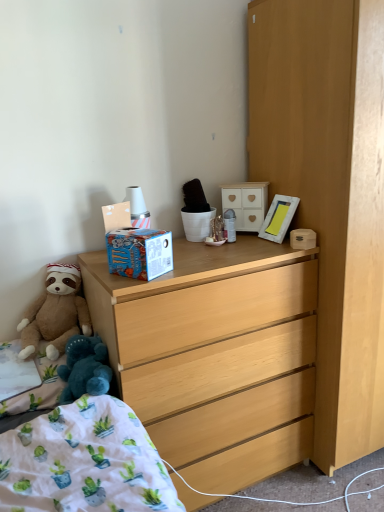
This screenshot has height=512, width=384. Describe the element at coordinates (55, 313) in the screenshot. I see `brown plush teddy bear at lower left` at that location.

What do you see at coordinates (216, 355) in the screenshot? Image resolution: width=384 pixels, height=512 pixels. I see `light wood dresser at center` at bounding box center [216, 355].

This screenshot has width=384, height=512. Describe the element at coordinates (246, 203) in the screenshot. I see `white painted wood cabinet at upper center, which is the 2th cabinetry from bottom to top` at that location.

Locate an element on the screen. The image size is (384, 512). light wood dresser at right, which ranks as the first cabinetry in right-to-left order is located at coordinates (330, 191).

Which is behind, point (55, 310) or point (295, 223)?

The point (295, 223) is farther from the camera.

Is brown plush teddy bear at lower left thinner than light wood dresser at right, which ranks as the 2th cabinetry in left-to-right order?

Yes.

Does brown plush teddy bear at lower left have a larger size compared to light wood dresser at right, the second cabinetry in the back-to-front sequence?

No.

Consider the image. From the image's perspective, is brown plush teddy bear at lower left on light wood dresser at right, which ranks as the first cabinetry in right-to-left order?

Actually, brown plush teddy bear at lower left appears below light wood dresser at right, which ranks as the first cabinetry in right-to-left order, in the image.

Which of these two, white wooden picture frame at upper right or light wood dresser at right, marked as the second cabinetry in a top-to-bottom arrangement, stands shorter?

white wooden picture frame at upper right.

Which is less distant, (x=267, y=229) or (x=344, y=388)?

The point (x=344, y=388) is more forward.

Identify the location of picture frame on the left of light wood dresser at right, which ranks as the 2th cabinetry in left-to-right order. 279,218.

From a real-world perspective, is white wooden picture frame at upper right located higher than light wood dresser at right, positioned as the first cabinetry in front-to-back order?

Correct, in the physical world, white wooden picture frame at upper right is higher than light wood dresser at right, positioned as the first cabinetry in front-to-back order.

Which object is positioned more to the right, light wood dresser at right, marked as the second cabinetry in a top-to-bottom arrangement, or white painted wood cabinet at upper center, which is counted as the 2th cabinetry, starting from the right?

light wood dresser at right, marked as the second cabinetry in a top-to-bottom arrangement, is more to the right.

Which is farther, (324,239) or (259,182)?

The point (259,182) is behind.

Looking at this image, could you tell me if light wood dresser at right, marked as the second cabinetry in a top-to-bottom arrangement, is facing white painted wood cabinet at upper center, which is counted as the 2th cabinetry, starting from the right?

No, light wood dresser at right, marked as the second cabinetry in a top-to-bottom arrangement, is not turned towards white painted wood cabinet at upper center, which is counted as the 2th cabinetry, starting from the right.

Looking at this image, is the surface of light wood dresser at right, positioned as the first cabinetry in front-to-back order, in direct contact with white painted wood cabinet at upper center, which is the 2th cabinetry from bottom to top?

light wood dresser at right, positioned as the first cabinetry in front-to-back order, and white painted wood cabinet at upper center, which is the 2th cabinetry from bottom to top, are not in contact.

Is white wooden picture frame at upper right to the right of light wood dresser at center from the viewer's perspective?

Yes.

In the image, there is a white wooden picture frame at upper right. Where is `desk below it (from the image's perspective)`? The image size is (384, 512). desk below it (from the image's perspective) is located at coordinates (216, 355).

Is point (281, 199) behind point (213, 405)?

Yes, point (281, 199) is farther from viewer.

Is white wooden picture frame at upper right inside the boundaries of light wood dresser at center, or outside?

white wooden picture frame at upper right is not inside light wood dresser at center, it's outside.

Is light wood dresser at right, which ranks as the first cabinetry in right-to-left order, oriented away from brown plush teddy bear at lower left?

light wood dresser at right, which ranks as the first cabinetry in right-to-left order, does not have its back to brown plush teddy bear at lower left.

Looking at this image, from the image's perspective, is light wood dresser at right, which ranks as the 2th cabinetry in left-to-right order, above or below brown plush teddy bear at lower left?

From the image's perspective, light wood dresser at right, which ranks as the 2th cabinetry in left-to-right order, appears above brown plush teddy bear at lower left.

From a real-world perspective, is light wood dresser at right, which is the first cabinetry in bottom-to-top order, physically below brown plush teddy bear at lower left?

No, from a real-world perspective, light wood dresser at right, which is the first cabinetry in bottom-to-top order, is not under brown plush teddy bear at lower left.

Could you measure the distance between light wood dresser at right, positioned as the first cabinetry in front-to-back order, and brown plush teddy bear at lower left?

They are 3.40 feet apart.

Is light wood dresser at center positioned with its back to light wood dresser at right, which is the first cabinetry in bottom-to-top order?

light wood dresser at center is not turned away from light wood dresser at right, which is the first cabinetry in bottom-to-top order.

Do you think light wood dresser at center is within light wood dresser at right, which ranks as the 2th cabinetry in left-to-right order, or outside of it?

light wood dresser at center is not enclosed by light wood dresser at right, which ranks as the 2th cabinetry in left-to-right order.

Visually, is light wood dresser at center positioned to the left or to the right of light wood dresser at right, marked as the second cabinetry in a top-to-bottom arrangement?

light wood dresser at center is positioned on light wood dresser at right, marked as the second cabinetry in a top-to-bottom arrangement,'s left side.

Where is `desk located on the left of light wood dresser at right, which ranks as the 2th cabinetry in left-to-right order`? This screenshot has width=384, height=512. desk located on the left of light wood dresser at right, which ranks as the 2th cabinetry in left-to-right order is located at coordinates (216, 355).

Find the location of `cabinetry that is the 2nd object located above the light wood dresser at center (from the image's perspective)`. cabinetry that is the 2nd object located above the light wood dresser at center (from the image's perspective) is located at coordinates (246, 203).

Would you say white painted wood cabinet at upper center, acting as the 1th cabinetry starting from the back, is inside or outside light wood dresser at center?

white painted wood cabinet at upper center, acting as the 1th cabinetry starting from the back, lies outside light wood dresser at center.

Which object is wider, white painted wood cabinet at upper center, which is counted as the 2th cabinetry, starting from the right, or light wood dresser at center?

With larger width is light wood dresser at center.

Can you confirm if white painted wood cabinet at upper center, which ranks as the 1th cabinetry in top-to-bottom order, is smaller than light wood dresser at center?

Yes, white painted wood cabinet at upper center, which ranks as the 1th cabinetry in top-to-bottom order, is smaller than light wood dresser at center.

You are a GUI agent. You are given a task and a screenshot of the screen. Output one action in this format:
    pyautogui.click(x=<x>, y=<y>)
    Task: Click on the teddy bear that appears behind the light wood dresser at right, marked as the second cabinetry in a top-to-bottom arrangement
    The image size is (384, 512).
    Given the screenshot: What is the action you would take?
    pyautogui.click(x=55, y=313)

I want to click on cabinetry below the white wooden picture frame at upper right (from a real-world perspective), so click(x=330, y=191).

Based on their spatial positions, is white wooden picture frame at upper right or brown plush teddy bear at lower left closer to white painted wood cabinet at upper center, which is the 2th cabinetry from bottom to top?

Based on the image, white wooden picture frame at upper right appears to be nearer to white painted wood cabinet at upper center, which is the 2th cabinetry from bottom to top.

Which object lies nearer to the anchor point light wood dresser at center, light wood dresser at right, marked as the second cabinetry in a top-to-bottom arrangement, or brown plush teddy bear at lower left?

light wood dresser at right, marked as the second cabinetry in a top-to-bottom arrangement, is positioned closer to the anchor light wood dresser at center.

Which object lies further to the anchor point light wood dresser at right, which is the first cabinetry in bottom-to-top order, white painted wood cabinet at upper center, acting as the 1th cabinetry starting from the back, or brown plush teddy bear at lower left?

brown plush teddy bear at lower left is positioned further to the anchor light wood dresser at right, which is the first cabinetry in bottom-to-top order.

Consider the image. Based on their spatial positions, is white painted wood cabinet at upper center, positioned as the 2th cabinetry in front-to-back order, or light wood dresser at right, positioned as the first cabinetry in front-to-back order, further from light wood dresser at center?

The object further to light wood dresser at center is white painted wood cabinet at upper center, positioned as the 2th cabinetry in front-to-back order.

From the image, which object appears to be nearer to white painted wood cabinet at upper center, which ranks as the 1th cabinetry in top-to-bottom order, white wooden picture frame at upper right or light wood dresser at center?

The object closer to white painted wood cabinet at upper center, which ranks as the 1th cabinetry in top-to-bottom order, is white wooden picture frame at upper right.

When comparing their distances from white painted wood cabinet at upper center, which is the 2th cabinetry from bottom to top, does light wood dresser at center or light wood dresser at right, which ranks as the first cabinetry in right-to-left order, seem further?

light wood dresser at center.

From the image, which object appears to be nearer to brown plush teddy bear at lower left, light wood dresser at right, positioned as the first cabinetry in front-to-back order, or white painted wood cabinet at upper center, positioned as the 2th cabinetry in front-to-back order?

white painted wood cabinet at upper center, positioned as the 2th cabinetry in front-to-back order, is closer to brown plush teddy bear at lower left.

From the image, which object appears to be nearer to light wood dresser at center, light wood dresser at right, the second cabinetry in the back-to-front sequence, or white painted wood cabinet at upper center, which ranks as the 1th cabinetry in top-to-bottom order?

light wood dresser at right, the second cabinetry in the back-to-front sequence, is closer to light wood dresser at center.

At what (x,y) coordinates should I click in order to perform the action: click on desk between brown plush teddy bear at lower left and light wood dresser at right, the second cabinetry in the back-to-front sequence, in the horizontal direction. Please return your answer as a coordinate pair (x, y). Looking at the image, I should click on (216, 355).

Where is `picture frame located between light wood dresser at center and light wood dresser at right, marked as the second cabinetry in a top-to-bottom arrangement, in the left-right direction`? This screenshot has height=512, width=384. picture frame located between light wood dresser at center and light wood dresser at right, marked as the second cabinetry in a top-to-bottom arrangement, in the left-right direction is located at coordinates (279, 218).

The width and height of the screenshot is (384, 512). In order to click on picture frame between white painted wood cabinet at upper center, which is the 2th cabinetry from bottom to top, and light wood dresser at center in the up-down direction in this screenshot , I will do tap(279, 218).

The height and width of the screenshot is (512, 384). Identify the location of picture frame between white painted wood cabinet at upper center, which is counted as the 2th cabinetry, starting from the right, and light wood dresser at right, positioned as the first cabinetry in front-to-back order, in the horizontal direction. (279, 218).